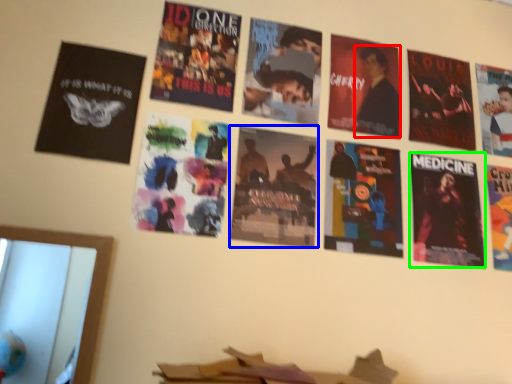
Question: Which object is positioned closest to person (highlighted by a red box)? Select from poster (highlighted by a blue box) and poster (highlighted by a green box).

Choices:
 (A) poster
 (B) poster

Answer: (B)